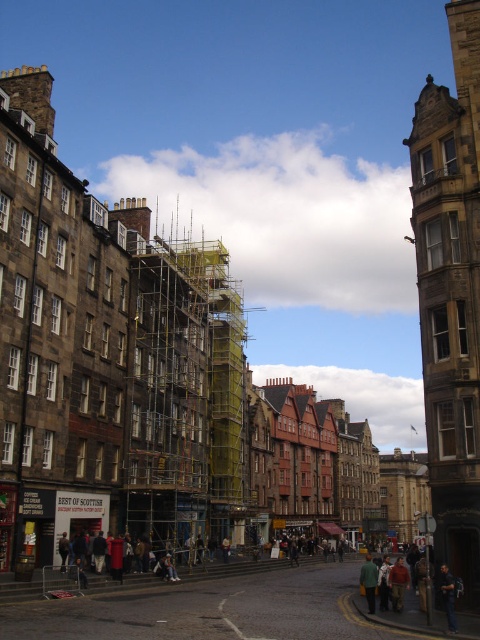
You are standing at point (369, 602) and want to walk to point (248, 598). Given the street layout, will you have to go around any obstacles or can you walk straight?

Since point (248, 598) is behind point (369, 602), you can walk straight to reach it without needing to go around any obstacles.